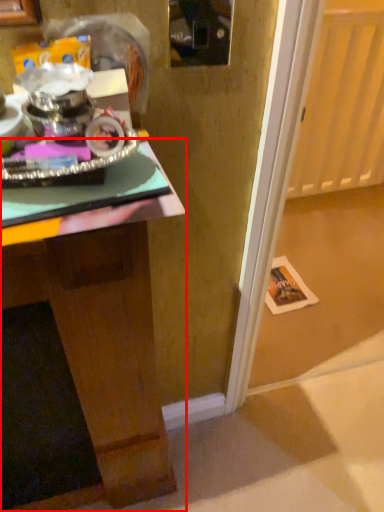
Question: Considering the relative positions of desk (annotated by the red box) and glass door in the image provided, where is desk (annotated by the red box) located with respect to the staircase?

Choices:
 (A) left
 (B) right

Answer: (A)